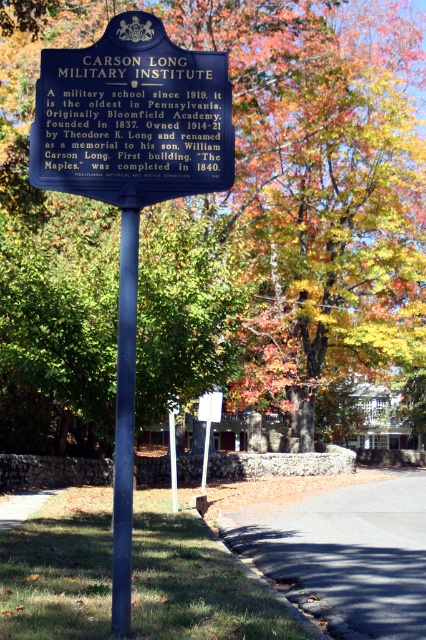
Is point (339, 358) closer to camera compared to point (121, 195)?

No, (339, 358) is further to viewer.

This screenshot has height=640, width=426. Identify the location of green leafy tree at center. (224, 224).

Who is positioned more to the left, green leafy tree at center or blue metal sign at center?

From the viewer's perspective, blue metal sign at center appears more on the left side.

Which is in front, point (19, 45) or point (138, 44)?

Point (138, 44) is more forward.

Which is behind, point (351, 150) or point (215, 97)?

The point (351, 150) is behind.

Identify the location of green leafy tree at center. (224, 224).

Which is more to the left, blue metallic pole at center or white plastic sign at center?

white plastic sign at center is more to the left.

Is blue metallic pole at center behind white plastic sign at center?

No, blue metallic pole at center is in front of white plastic sign at center.

Is point (134, 284) closer to viewer compared to point (199, 413)?

Yes, point (134, 284) is in front of point (199, 413).

The image size is (426, 640). Find the location of `blue metallic pole at center`. blue metallic pole at center is located at coordinates [x=124, y=412].